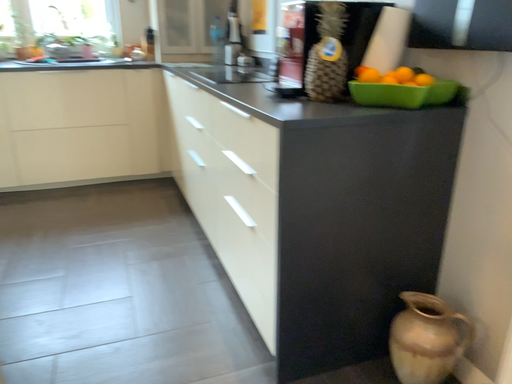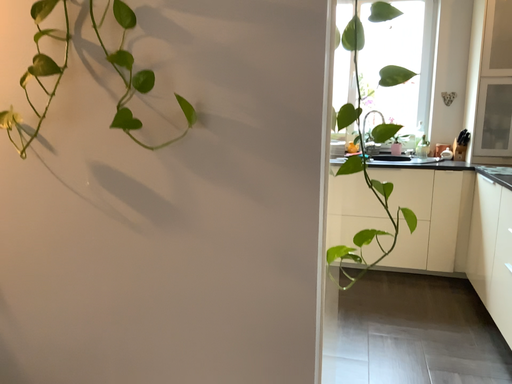
Question: Which way did the camera rotate in the video?

Choices:
 (A) rotated right
 (B) rotated left

Answer: (B)